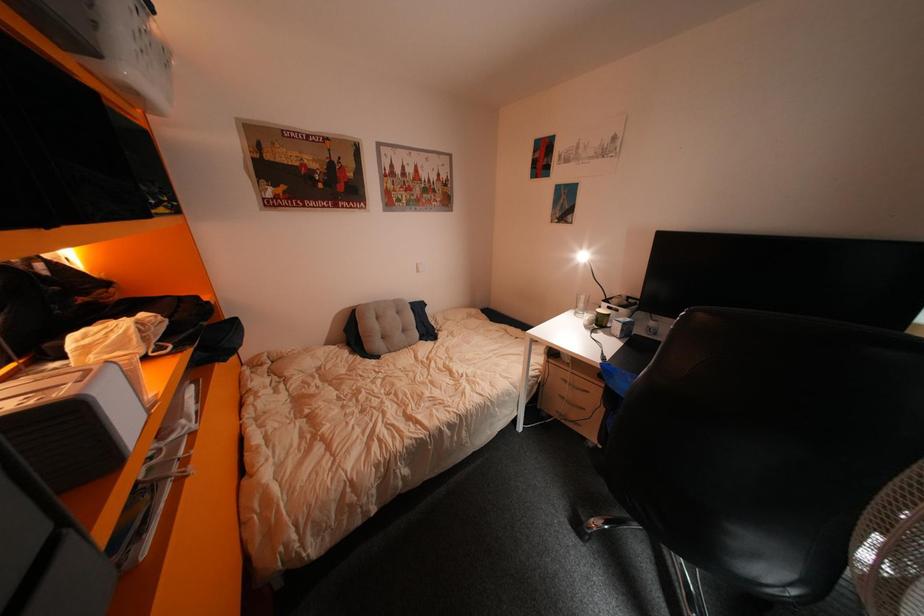
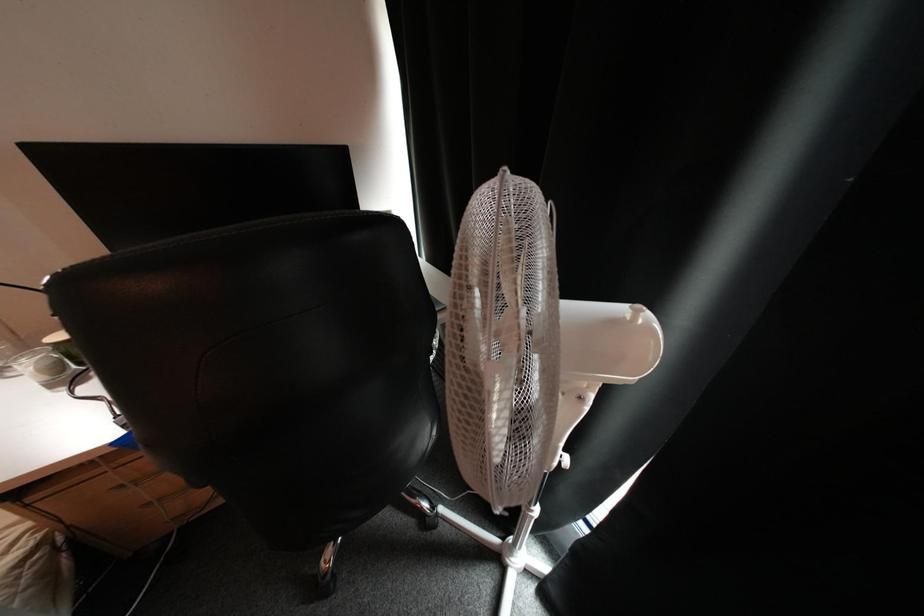
How did the camera likely rotate?

The camera's rotation is toward right-down.